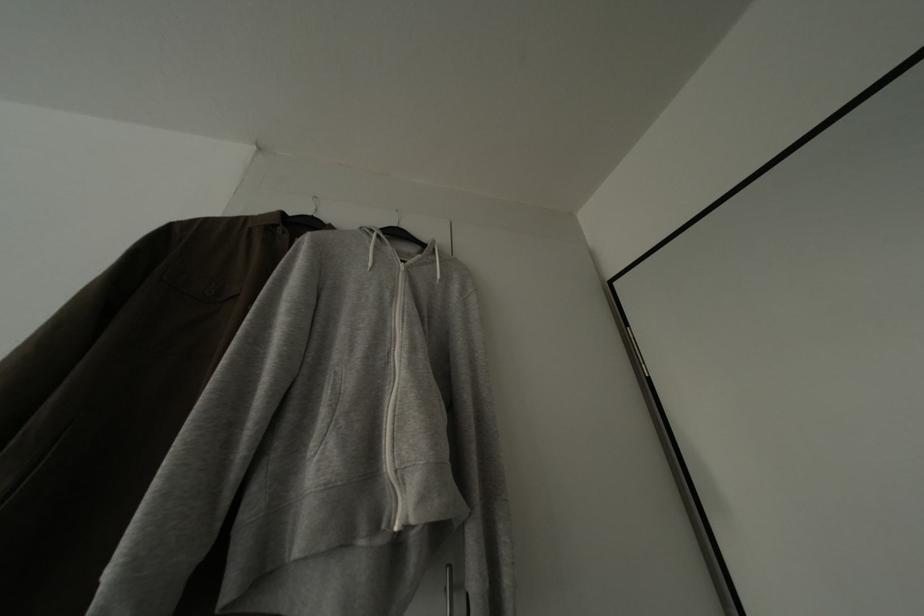
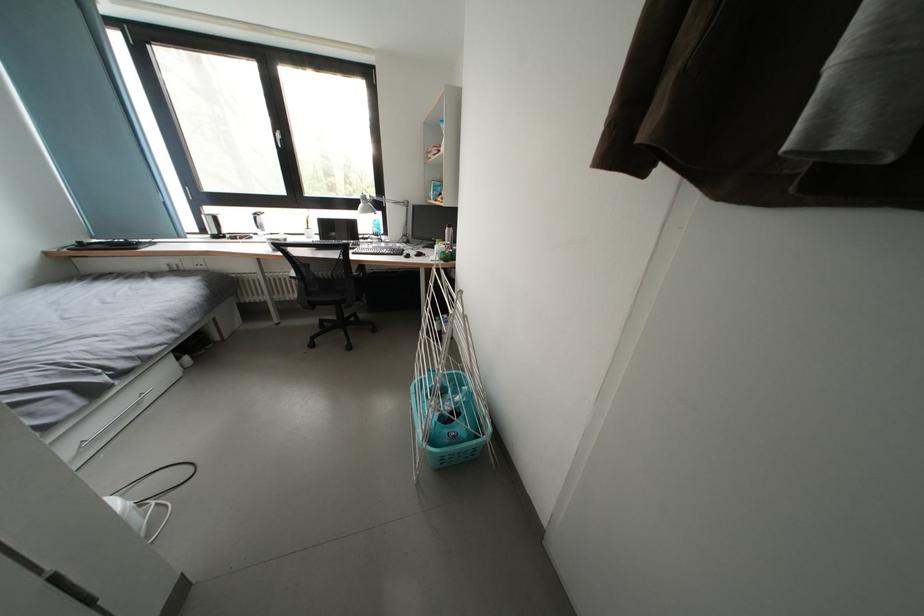
The images are taken continuously from a first-person perspective. In which direction is your viewpoint rotating?

The camera's rotation is toward left-down.